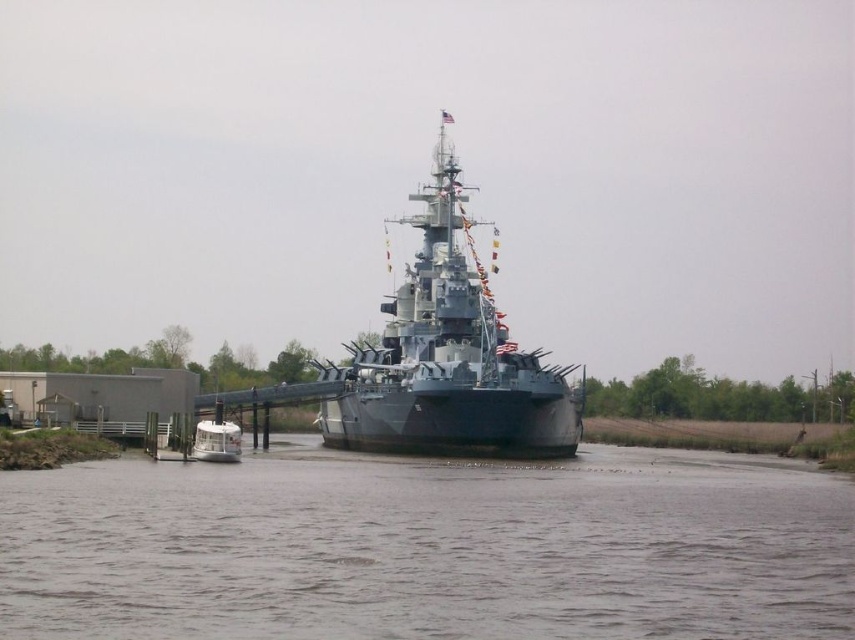
Question: Does gray water at center have a lesser width compared to gray metallic battleship at center?

Choices:
 (A) yes
 (B) no

Answer: (B)

Question: Is gray water at center behind gray metallic battleship at center?

Choices:
 (A) no
 (B) yes

Answer: (A)

Question: Is gray water at center to the right of gray metallic battleship at center from the viewer's perspective?

Choices:
 (A) no
 (B) yes

Answer: (B)

Question: Which of the following is the farthest from the observer?

Choices:
 (A) gray metallic battleship at center
 (B) gray water at center

Answer: (A)

Question: Which object is closer to the camera taking this photo?

Choices:
 (A) gray water at center
 (B) gray metallic battleship at center

Answer: (A)